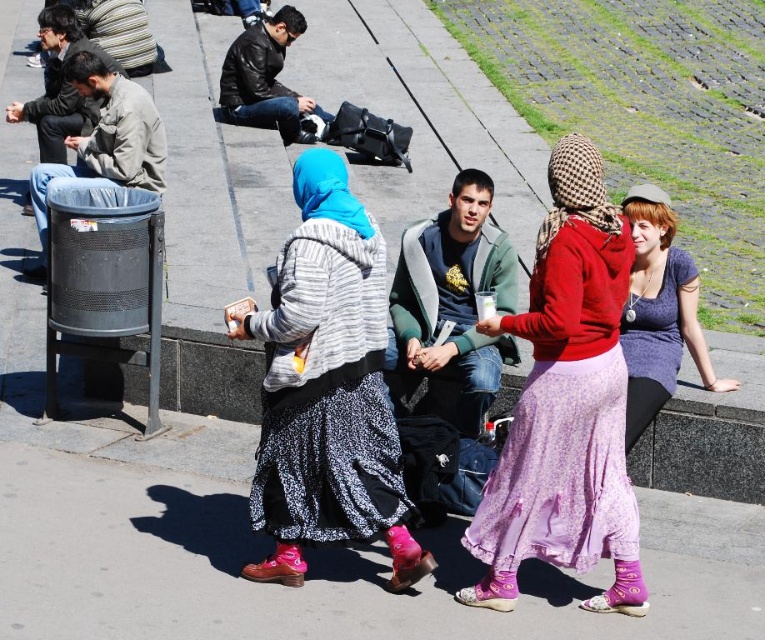
Question: Which of these objects is positioned closest to the black leather jacket at upper center?

Choices:
 (A) blue fabric headscarf at center
 (B) matte red hoodie at center

Answer: (A)

Question: Is matte red hoodie at center to the right of blue fabric headscarf at center from the viewer's perspective?

Choices:
 (A) yes
 (B) no

Answer: (A)

Question: Estimate the real-world distances between objects in this image. Which object is closer to the black leather jacket at upper center?

Choices:
 (A) blue fabric headscarf at center
 (B) matte red hoodie at center

Answer: (A)

Question: Can you confirm if matte red hoodie at center is positioned to the left of blue fabric headscarf at center?

Choices:
 (A) yes
 (B) no

Answer: (B)

Question: Among these points, which one is nearest to the camera?

Choices:
 (A) (552, 228)
 (B) (246, 122)
 (C) (353, 316)

Answer: (A)

Question: Is matte red hoodie at center smaller than black leather jacket at upper center?

Choices:
 (A) yes
 (B) no

Answer: (A)